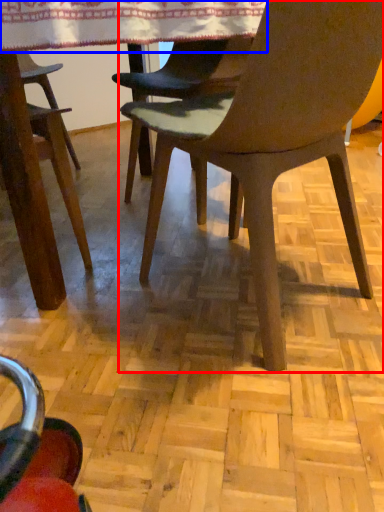
Question: Which object is closer to the camera taking this photo, chair (highlighted by a red box) or tablecloth (highlighted by a blue box)?

Choices:
 (A) chair
 (B) tablecloth

Answer: (A)